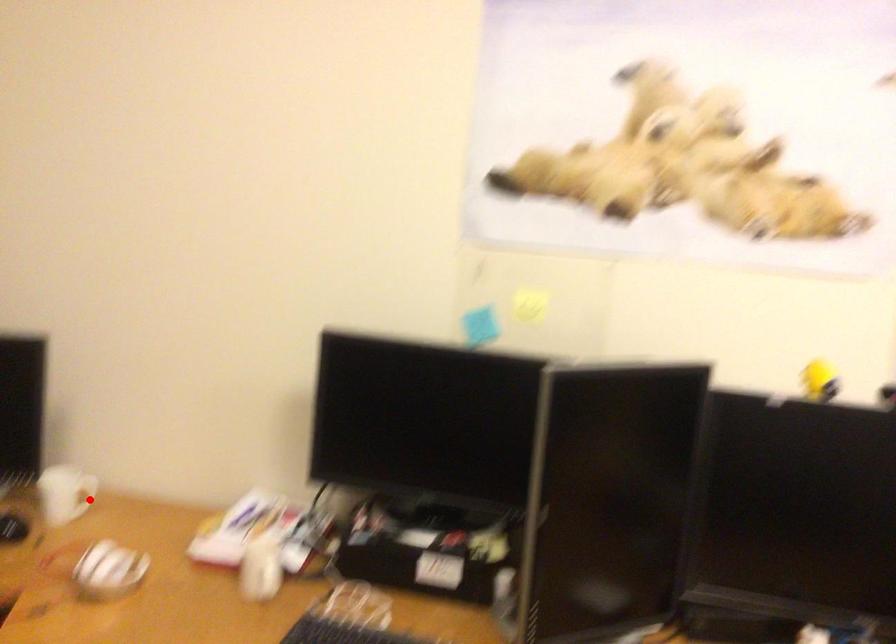
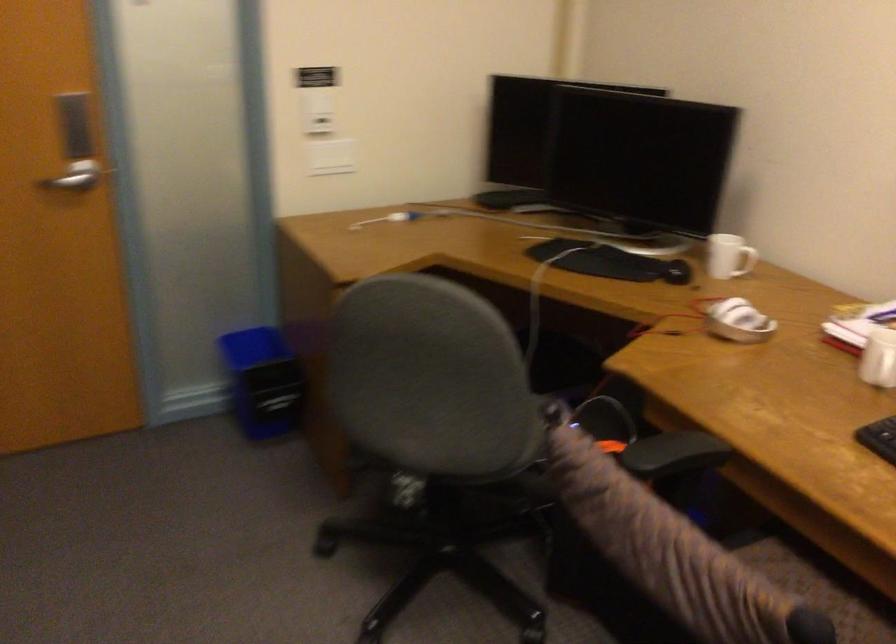
The point at the highlighted location is marked in the first image. Where is the corresponding point in the second image?

(745, 261)